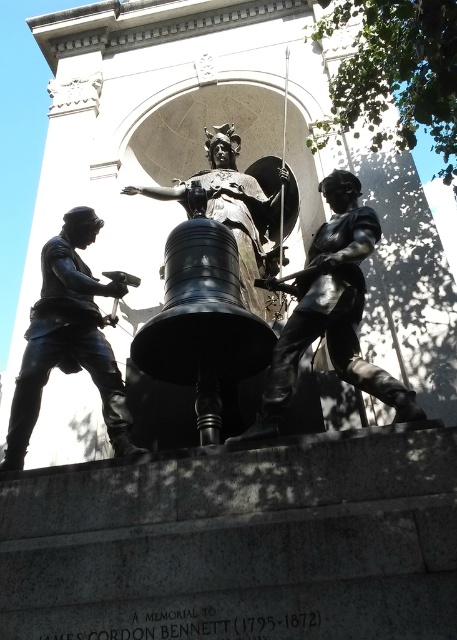
Question: Can you confirm if shiny bronze statue at center is positioned below bronze statue at center?

Choices:
 (A) no
 (B) yes

Answer: (B)

Question: Which point is closer to the camera?

Choices:
 (A) bronze statue at center
 (B) shiny bronze statue at center

Answer: (B)

Question: Which object is the closest to the shiny bronze statue at center?

Choices:
 (A) bronze statue at left
 (B) bronze statue at center

Answer: (B)

Question: Is bronze statue at left wider than bronze statue at center?

Choices:
 (A) no
 (B) yes

Answer: (A)

Question: Can you confirm if shiny bronze statue at center is positioned below bronze statue at left?

Choices:
 (A) no
 (B) yes

Answer: (A)

Question: Based on their relative distances, which object is farther from the bronze statue at center?

Choices:
 (A) bronze statue at left
 (B) shiny bronze statue at center

Answer: (A)